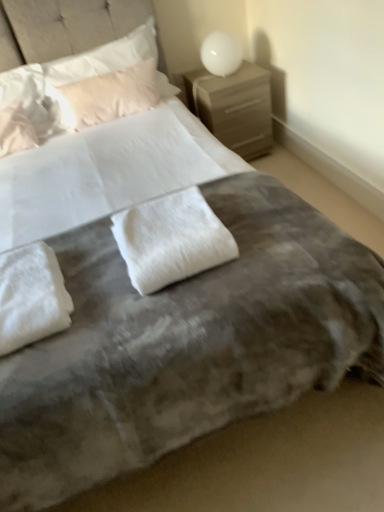
Question: Can you confirm if white glossy sphere at upper right is smaller than white fluffy pillow at center, positioned as the second pillow in front-to-back order?

Choices:
 (A) no
 (B) yes

Answer: (A)

Question: Is white glossy sphere at upper right turned away from white fluffy pillow at center, the 5th pillow viewed from the back?

Choices:
 (A) yes
 (B) no

Answer: (B)

Question: Considering the relative sizes of white glossy sphere at upper right and white fluffy pillow at center, positioned as the second pillow in front-to-back order, in the image provided, is white glossy sphere at upper right bigger than white fluffy pillow at center, positioned as the second pillow in front-to-back order,?

Choices:
 (A) yes
 (B) no

Answer: (A)

Question: Is white glossy sphere at upper right far away from white fluffy pillow at center, positioned as the second pillow in front-to-back order?

Choices:
 (A) yes
 (B) no

Answer: (A)

Question: Is white glossy sphere at upper right thinner than white fluffy pillow at center, the 5th pillow viewed from the back?

Choices:
 (A) yes
 (B) no

Answer: (A)

Question: Considering the relative positions of white soft pillow at upper left, the 5th pillow when ordered from front to back, and white fluffy pillow at upper left, positioned as the 4th pillow in front-to-back order, in the image provided, is white soft pillow at upper left, the 5th pillow when ordered from front to back, to the left or to the right of white fluffy pillow at upper left, positioned as the 4th pillow in front-to-back order,?

Choices:
 (A) right
 (B) left

Answer: (A)

Question: Based on their sizes in the image, would you say white soft pillow at upper left, placed as the second pillow when sorted from back to front, is bigger or smaller than white fluffy pillow at upper left, marked as the third pillow in a back-to-front arrangement?

Choices:
 (A) small
 (B) big

Answer: (B)

Question: Does point (109, 69) appear closer or farther from the camera than point (29, 73)?

Choices:
 (A) farther
 (B) closer

Answer: (A)

Question: Is white soft pillow at upper left, placed as the second pillow when sorted from back to front, wider or thinner than white fluffy pillow at upper left, positioned as the 4th pillow in front-to-back order?

Choices:
 (A) wide
 (B) thin

Answer: (B)

Question: From a real-world perspective, relative to white fluffy pillow at upper left, positioned as the 4th pillow in front-to-back order, is white fluffy pillow at upper left, the third pillow from the front, vertically above or below?

Choices:
 (A) below
 (B) above

Answer: (A)

Question: Considering the positions of white fluffy pillow at upper left, the third pillow from the front, and white fluffy pillow at upper left, marked as the third pillow in a back-to-front arrangement, in the image, is white fluffy pillow at upper left, the third pillow from the front, taller or shorter than white fluffy pillow at upper left, marked as the third pillow in a back-to-front arrangement,?

Choices:
 (A) tall
 (B) short

Answer: (B)

Question: Based on their positions, is white fluffy pillow at upper left, which ranks as the fourth pillow in back-to-front order, located to the left or right of white fluffy pillow at upper left, marked as the third pillow in a back-to-front arrangement?

Choices:
 (A) left
 (B) right

Answer: (A)

Question: Does point (1, 124) appear closer or farther from the camera than point (41, 73)?

Choices:
 (A) closer
 (B) farther

Answer: (A)

Question: From a real-world perspective, relative to white fluffy pillow at lower left, which is counted as the 1th pillow, starting from the front, is white fluffy pillow at upper left, the third pillow from the front, vertically above or below?

Choices:
 (A) above
 (B) below

Answer: (A)

Question: In terms of size, does white fluffy pillow at upper left, the third pillow from the front, appear bigger or smaller than white fluffy pillow at lower left, the 6th pillow positioned from the back?

Choices:
 (A) small
 (B) big

Answer: (B)